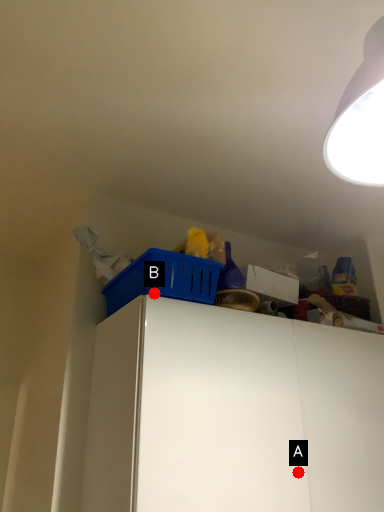
Question: Two points are circled on the image, labeled by A and B beside each circle. Which point is farther from the camera taking this photo?

Choices:
 (A) A is further
 (B) B is further

Answer: (A)